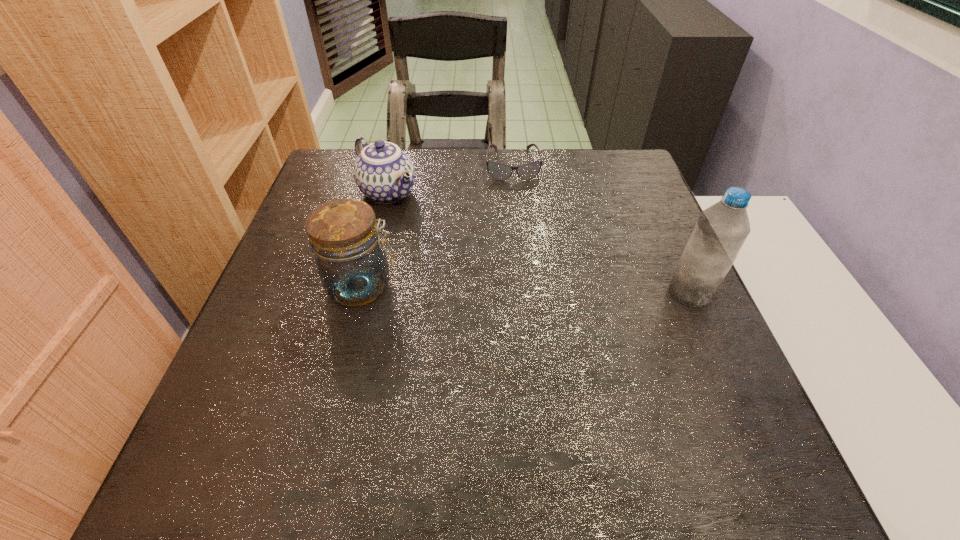
Identify the location of the second tallest object. (343, 234).

In order to click on the rightmost object in this screenshot , I will do `click(721, 230)`.

Identify the location of water bottle. This screenshot has height=540, width=960. (721, 230).

Find the location of a particular element. sunglasses is located at coordinates (500, 171).

Identify the location of the second object from right to left. This screenshot has height=540, width=960. (500, 171).

In order to click on chinaware in this screenshot , I will do `click(383, 172)`.

Where is `vacant space positioned 0.210m on the lid of the third shortest object`? vacant space positioned 0.210m on the lid of the third shortest object is located at coordinates (497, 286).

At what (x,y) coordinates should I click in order to perform the action: click on vacant space located on the left of the rightmost object. Please return your answer as a coordinate pair (x, y). Looking at the image, I should click on (531, 293).

Image resolution: width=960 pixels, height=540 pixels. What are the coordinates of `vacant region located on the lenses of the second object from right to left` in the screenshot? It's located at (x=520, y=232).

Image resolution: width=960 pixels, height=540 pixels. I want to click on vacant area located on the lenses of the second object from right to left, so point(527,291).